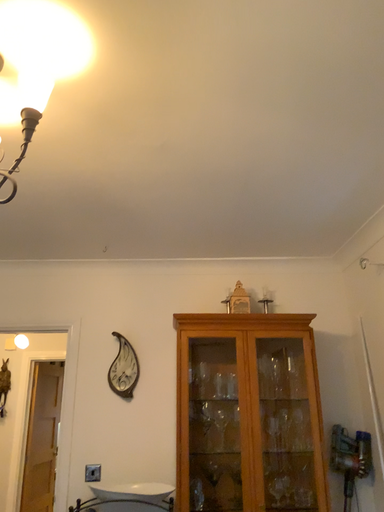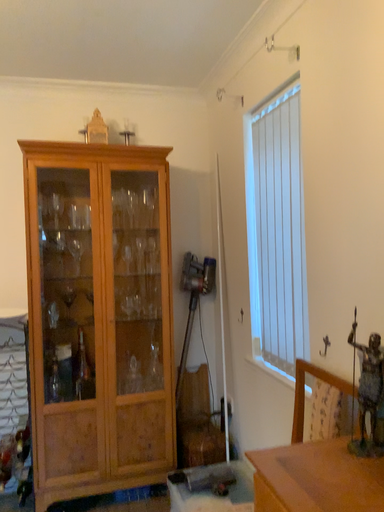
Question: How did the camera likely rotate when shooting the video?

Choices:
 (A) rotated left
 (B) rotated right

Answer: (B)